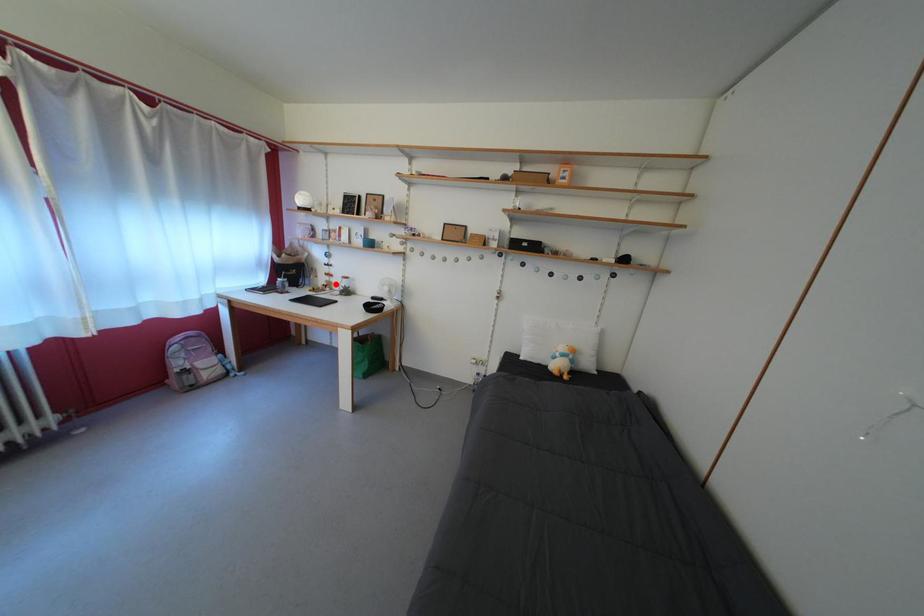
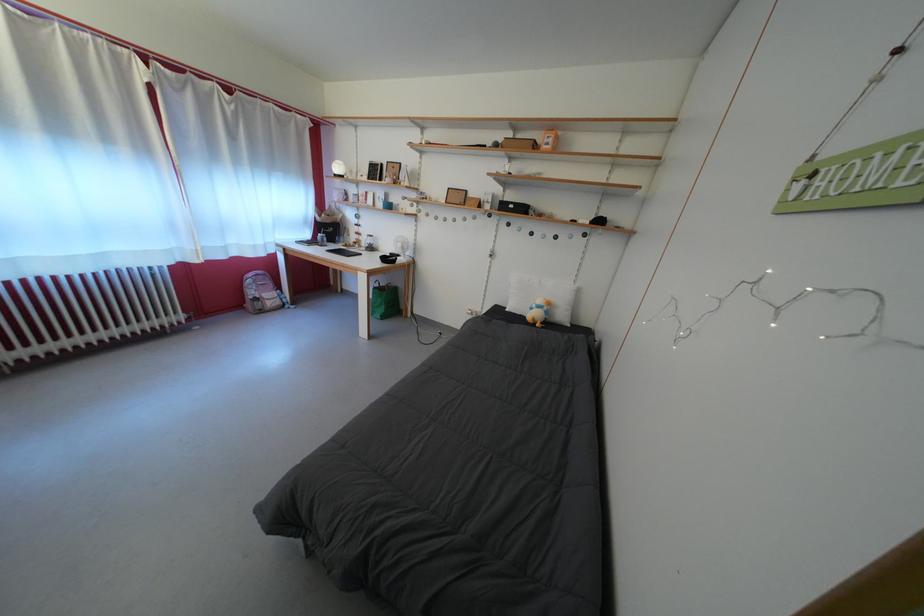
Question: I am providing you with two images of the same scene from different viewpoints. A red point is marked on the first image. Is the red point's position out of view in image 2?

Choices:
 (A) Yes
 (B) No

Answer: (B)